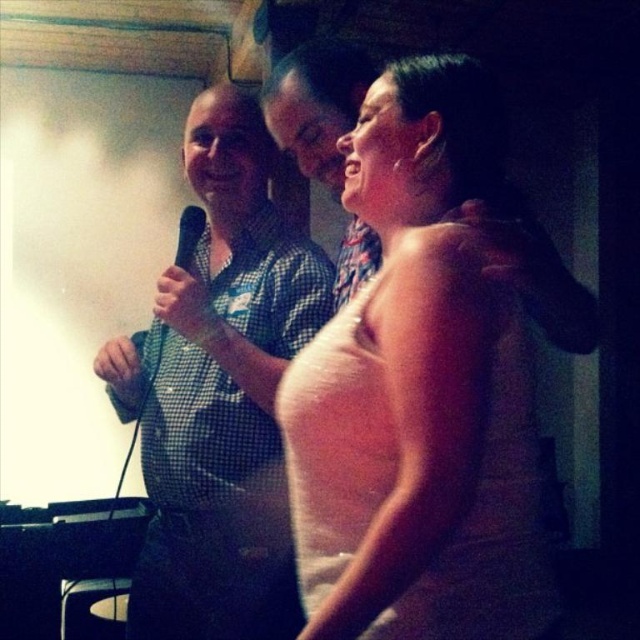
Is point (353, 468) positioned after point (112, 358)?

No, (353, 468) is in front of (112, 358).

Is point (440, 600) more distant than point (257, 220)?

No, it is in front of (257, 220).

Find the location of `pink satin dress at center`. pink satin dress at center is located at coordinates pos(420,388).

Does point (221, 397) come behind point (198, 209)?

No, (221, 397) is in front of (198, 209).

Does checkered fabric shirt at left have a greater width compared to black matte microphone at center?

Correct, the width of checkered fabric shirt at left exceeds that of black matte microphone at center.

Who is more distant from viewer, (195, 102) or (192, 237)?

The point (195, 102) is behind.

This screenshot has height=640, width=640. What are the coordinates of `checkered fabric shirt at left` in the screenshot? It's located at (220, 394).

In the scene shown: Is pink satin dress at center positioned in front of black matte microphone at center?

Yes.

Is pink satin dress at center bigger than black matte microphone at center?

Correct, pink satin dress at center is larger in size than black matte microphone at center.

You are a GUI agent. You are given a task and a screenshot of the screen. Output one action in this format:
    pyautogui.click(x=<x>, y=<y>)
    Task: Click on the pink satin dress at center
    This screenshot has height=640, width=640.
    Given the screenshot: What is the action you would take?
    pyautogui.click(x=420, y=388)